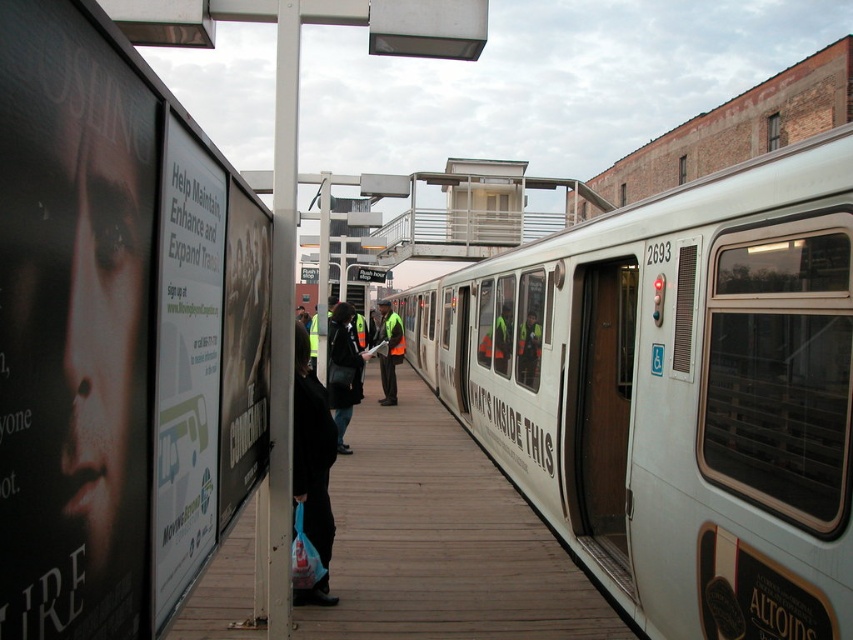
Question: Which object is positioned farthest from the white paper poster at left?

Choices:
 (A) reflective yellow vest at center
 (B) reflective safety vest at train door
 (C) white metallic train at center

Answer: (A)

Question: Which point appears closest to the camera in this image?

Choices:
 (A) (329, 550)
 (B) (178, 545)
 (C) (686, 616)
 (D) (335, 305)

Answer: (B)

Question: Is white paper poster at left wider than black fabric bag at lower center?

Choices:
 (A) no
 (B) yes

Answer: (A)

Question: Does white paper poster at left lie behind reflective yellow vest at center?

Choices:
 (A) yes
 (B) no

Answer: (B)

Question: Considering the real-world distances, which object is farthest from the white metallic train at center?

Choices:
 (A) reflective yellow vest at center
 (B) reflective safety vest at train door
 (C) white paper poster at left

Answer: (C)

Question: Can you confirm if white metallic train at center is positioned below matte black jacket at center?

Choices:
 (A) yes
 (B) no

Answer: (B)